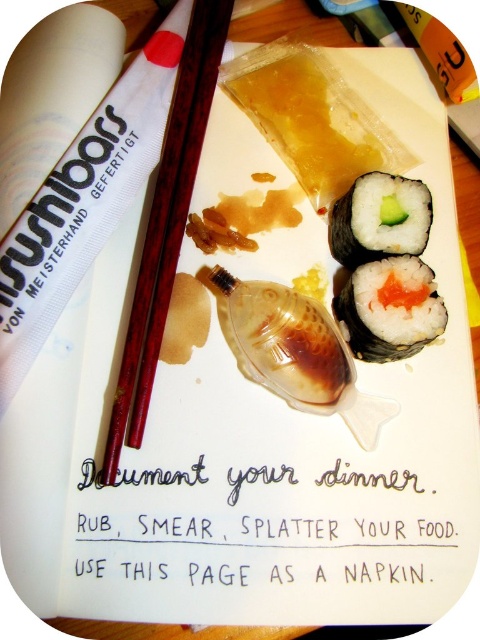
What object is located at the coordinates point (x=166, y=225)?

The point (x=166, y=225) corresponds to brown wood chopsticks at center.

You are trying to place the brown wood chopsticks at center on the notebook page. Based on their current position, can you determine if they are closer to the top or bottom edge of the page?

The brown wood chopsticks at center are located at point 0.346 on the vertical axis, which is closer to the bottom edge of the page since 0.346 is less than half of the page height.

Looking at the notebook page turned into a napkin, you notice two pieces of sushi. Which one is taller, the white rice with salmon filling at center or the white rice with seaweed at upper center?

The white rice with salmon filling at center is taller than the white rice with seaweed at upper center.